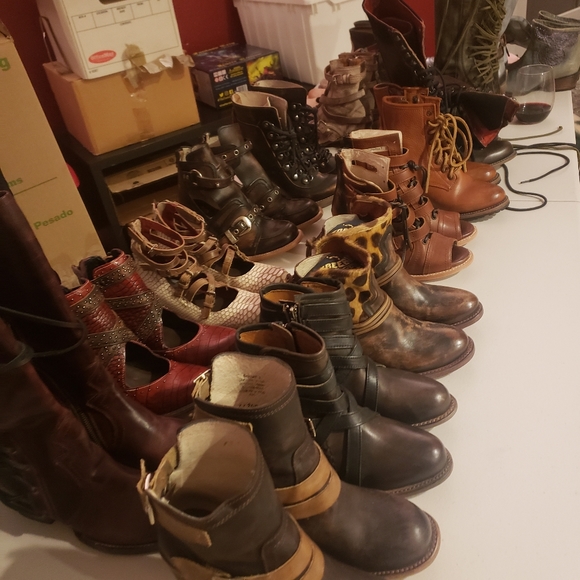
The width and height of the screenshot is (580, 580). What are the coordinates of `cardboard box` in the screenshot? It's located at (108, 119), (119, 39), (222, 79), (43, 155).